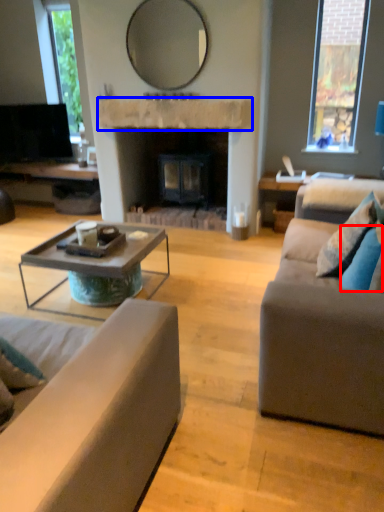
Question: Which object is further to the camera taking this photo, pillow (highlighted by a red box) or mantle (highlighted by a blue box)?

Choices:
 (A) pillow
 (B) mantle

Answer: (B)